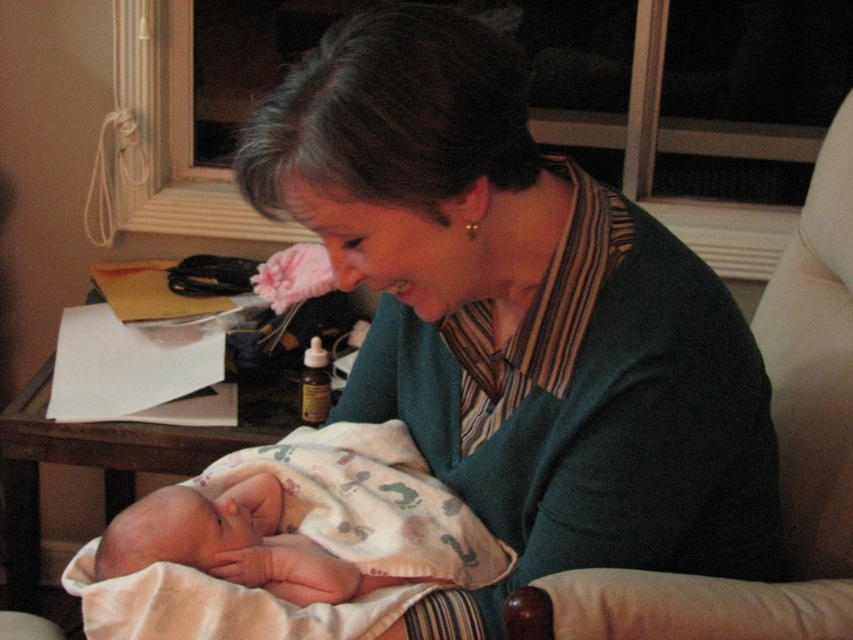
Is point (838, 468) closer to viewer compared to point (126, 513)?

That is False.

Image resolution: width=853 pixels, height=640 pixels. I want to click on white fabric armchair at right, so click(779, 461).

The width and height of the screenshot is (853, 640). Identify the location of white fabric armchair at right. (779, 461).

Is matte green sweater at center closer to camera compared to white fabric armchair at right?

Yes, matte green sweater at center is in front of white fabric armchair at right.

Between matte green sweater at center and white fabric armchair at right, which one is positioned higher?

matte green sweater at center is higher up.

Does point (756, 419) come closer to viewer compared to point (833, 145)?

Yes.

The height and width of the screenshot is (640, 853). I want to click on matte green sweater at center, so click(x=518, y=316).

Can you confirm if matte green sweater at center is bigger than soft pink blanket at center?

Indeed, matte green sweater at center has a larger size compared to soft pink blanket at center.

Looking at this image, does matte green sweater at center have a greater width compared to soft pink blanket at center?

Correct, the width of matte green sweater at center exceeds that of soft pink blanket at center.

Describe the element at coordinates (518, 316) in the screenshot. I see `matte green sweater at center` at that location.

The height and width of the screenshot is (640, 853). What are the coordinates of `matte green sweater at center` in the screenshot? It's located at (518, 316).